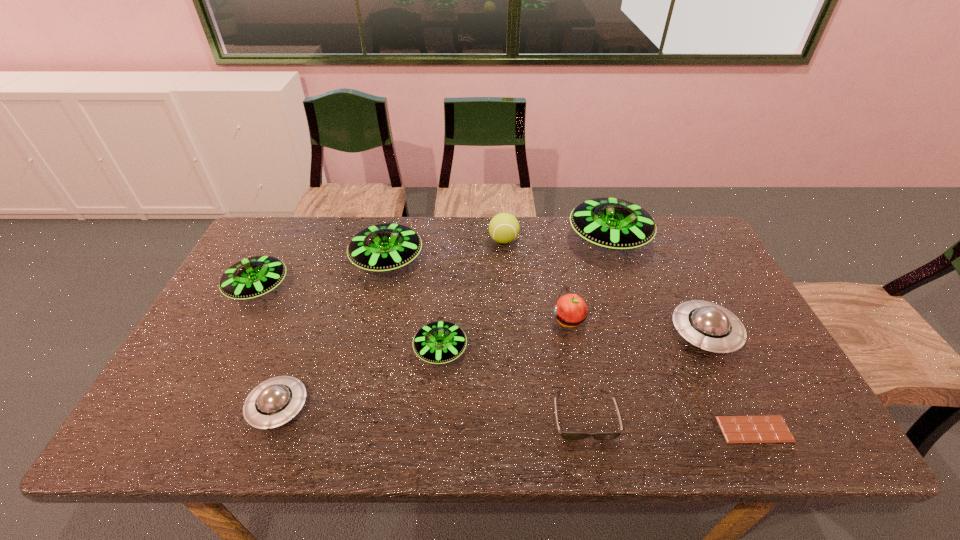
Identify the location of the farther gray saucer. The image size is (960, 540). (704, 324).

At what (x,y) coordinates should I click in order to perform the action: click on the smallest green saucer. Please return your answer as a coordinate pair (x, y). Looking at the image, I should click on (439, 342).

The width and height of the screenshot is (960, 540). Identify the location of the third saucer from right to left. (439, 342).

Find the location of a particular element. the left gray saucer is located at coordinates (274, 402).

Locate an element on the screen. The height and width of the screenshot is (540, 960). the smaller gray saucer is located at coordinates point(274,402).

You are a GUI agent. You are given a task and a screenshot of the screen. Output one action in this format:
    pyautogui.click(x=<x>, y=<y>)
    Task: Click on the sunglasses
    This screenshot has width=960, height=540.
    Given the screenshot: What is the action you would take?
    pyautogui.click(x=565, y=435)

At what (x,y) coordinates should I click in order to perform the action: click on black sunglasses. Please return your answer as a coordinate pair (x, y). Looking at the image, I should click on (565, 435).

I want to click on chocolate bar, so click(x=768, y=428).

Locate an element on the screen. The image size is (960, 540). free space located on the front of the tallest object is located at coordinates (632, 306).

I want to click on vacant space located 0.110m on the right of the third smallest green saucer, so click(458, 260).